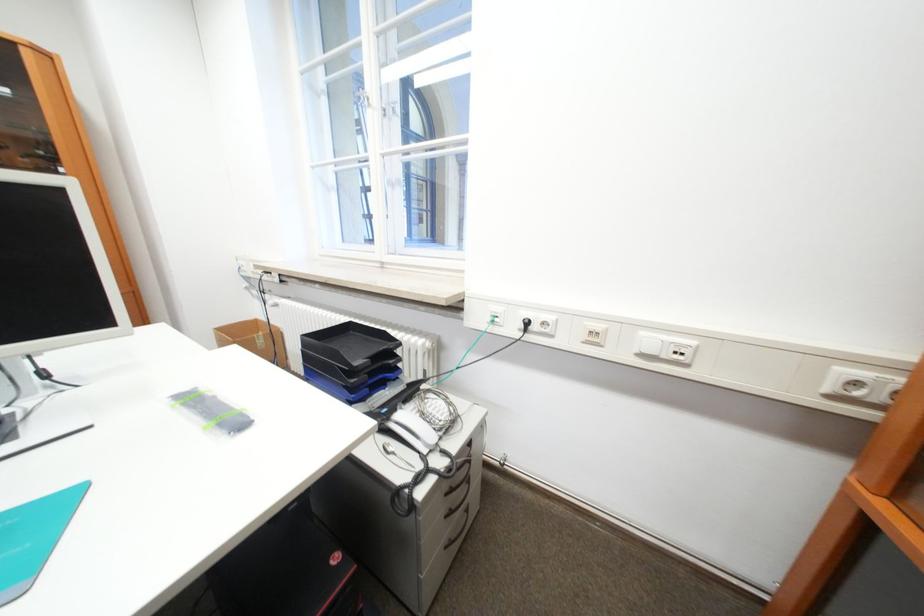
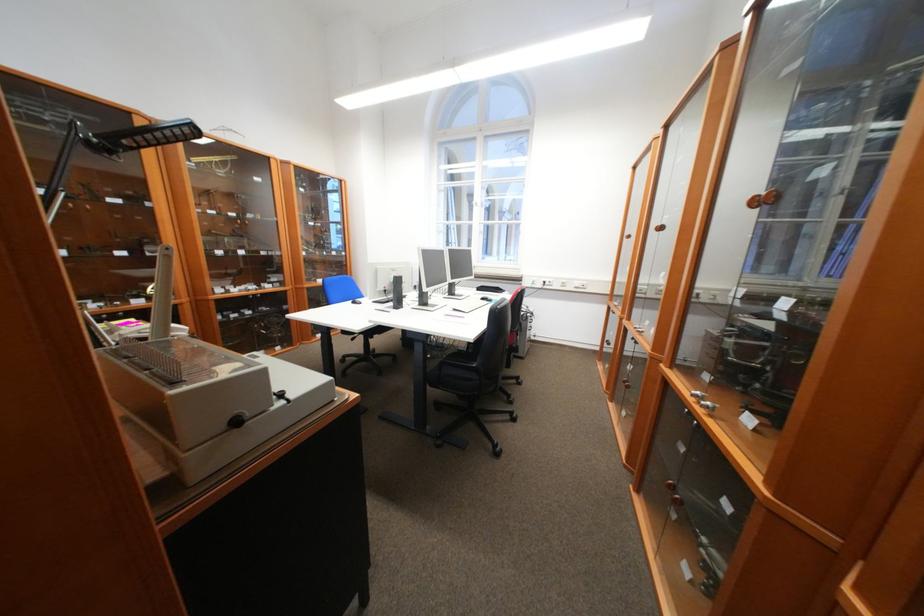
Find the pixel in the second image that matches [562,338] in the first image.

(562, 286)